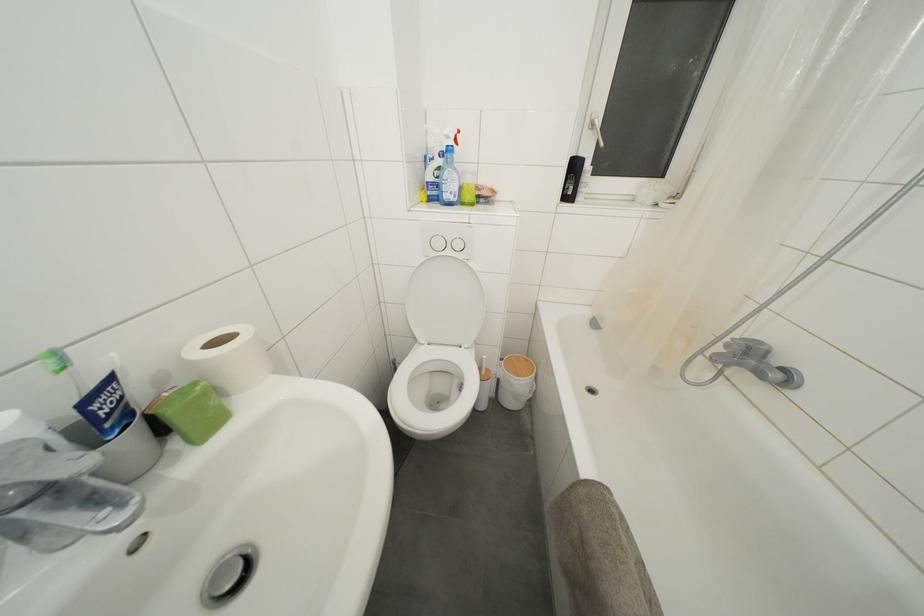
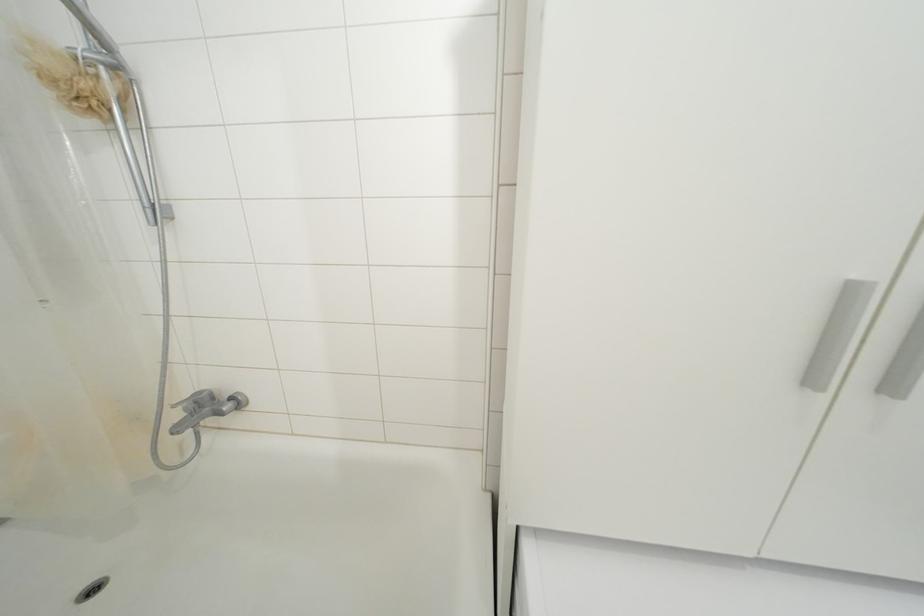
Based on the continuous images, in which direction is the camera rotating?

The camera's rotation is toward right-down.